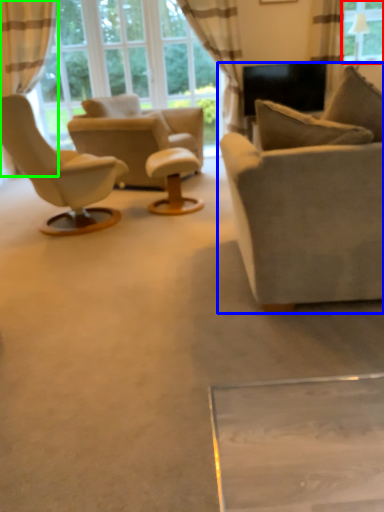
Question: Considering the real-world distances, which object is farthest from window (highlighted by a red box)? studio couch (highlighted by a blue box) or curtain (highlighted by a green box)?

Choices:
 (A) studio couch
 (B) curtain

Answer: (B)